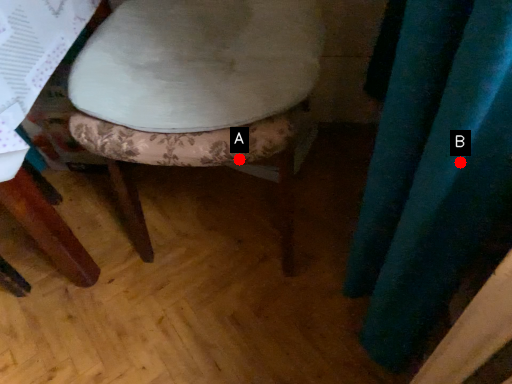
Question: Two points are circled on the image, labeled by A and B beside each circle. Which point is closer to the camera?

Choices:
 (A) A is closer
 (B) B is closer

Answer: (B)